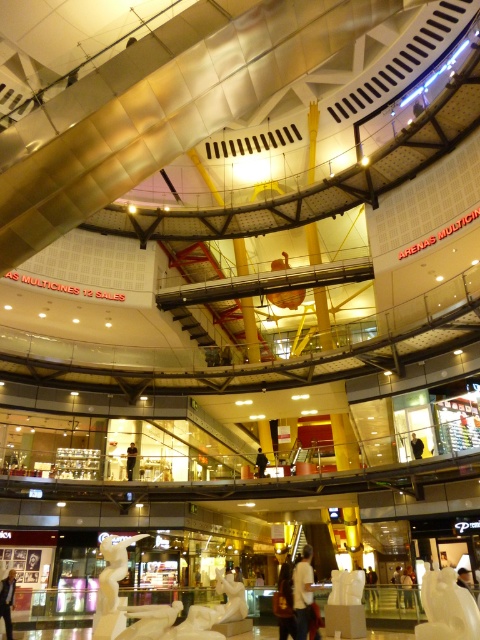
Question: Which object is farther from the camera taking this photo?

Choices:
 (A) dark blue jeans at center
 (B) black fabric person at center
 (C) white marble statue at center

Answer: (A)

Question: Can you confirm if dark blue jeans at center is positioned to the left of black fabric person at center?

Choices:
 (A) no
 (B) yes

Answer: (B)

Question: Among these points, which one is nearest to the camera?

Choices:
 (A) (257, 468)
 (B) (8, 602)

Answer: (B)

Question: Does dark blue jeans at lower left have a smaller size compared to white statue at center?

Choices:
 (A) no
 (B) yes

Answer: (B)

Question: Is dark blue jeans at center smaller than black fabric person at center?

Choices:
 (A) yes
 (B) no

Answer: (B)

Question: Which point is closer to the camera?

Choices:
 (A) white statue at center
 (B) white matte statue at center
 (C) black fabric person at center
 (D) white marble statue at center

Answer: (D)